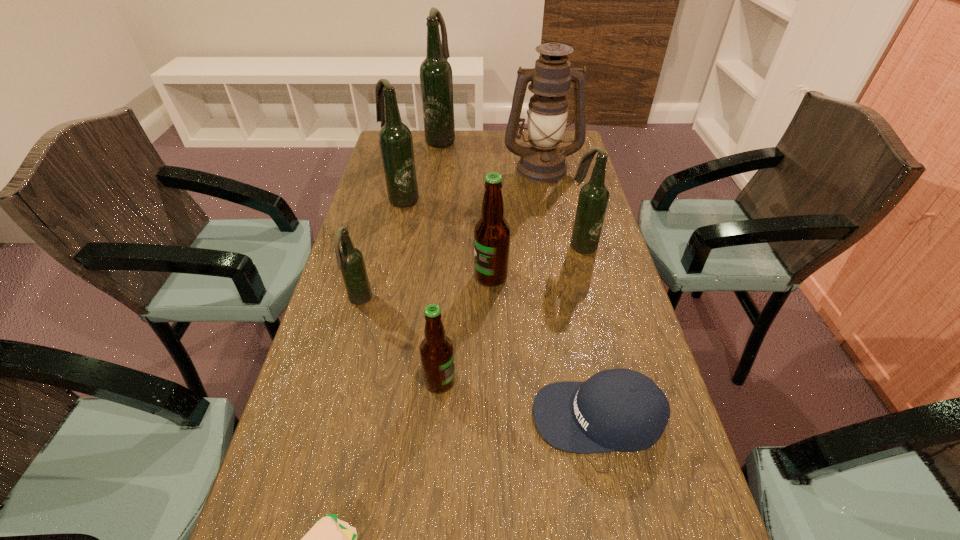
At what (x,y) coordinates should I click in order to perform the action: click on free space between the biggest dark beer bottle and the nearest dark beer bottle. Please return your answer as a coordinate pair (x, y). The width and height of the screenshot is (960, 540). Looking at the image, I should click on pyautogui.click(x=400, y=220).

Identify the location of vacant area that lies between the eighth nearest object and the sixth farthest object. (450, 234).

Where is `blank region between the eighth tallest object and the third nearest beer bottle`? The width and height of the screenshot is (960, 540). blank region between the eighth tallest object and the third nearest beer bottle is located at coordinates (545, 346).

Identify the location of empty location between the blue baseball cap and the third biggest dark beer bottle. The width and height of the screenshot is (960, 540). (589, 330).

Find the location of `vacant space in between the third farthest object and the biggest dark beer bottle`. vacant space in between the third farthest object and the biggest dark beer bottle is located at coordinates [x=421, y=169].

Image resolution: width=960 pixels, height=540 pixels. In order to click on object that is the second closest to the second beer bottle from right to left in this screenshot , I will do [x=436, y=350].

The height and width of the screenshot is (540, 960). What are the coordinates of `the closest object relative to the fourth nearest object` in the screenshot? It's located at (436, 350).

You are a GUI agent. You are given a task and a screenshot of the screen. Output one action in this format:
    pyautogui.click(x=<x>, y=<y>)
    Task: Click on the second closest beer bottle to the baseball cap
    Image resolution: width=960 pixels, height=540 pixels.
    Given the screenshot: What is the action you would take?
    pyautogui.click(x=492, y=232)

Locate which beer bottle is the third closest to the tallest beer bottle. Please provide its 2D coordinates. Your answer should be formatted as a tuple, i.e. [(x, y)], where the tuple contains the x and y coordinates of a point satisfying the conditions above.

[(492, 232)]

Choose which dark beer bottle is the third nearest neighbor to the fifth farthest beer bottle. Please provide its 2D coordinates. Your answer should be formatted as a tuple, i.e. [(x, y)], where the tuple contains the x and y coordinates of a point satisfying the conditions above.

[(436, 79)]